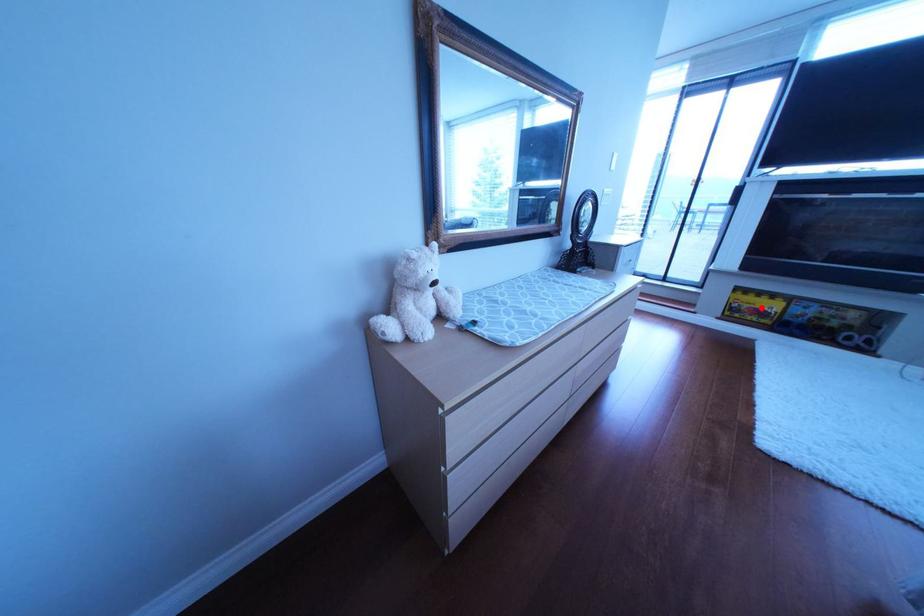
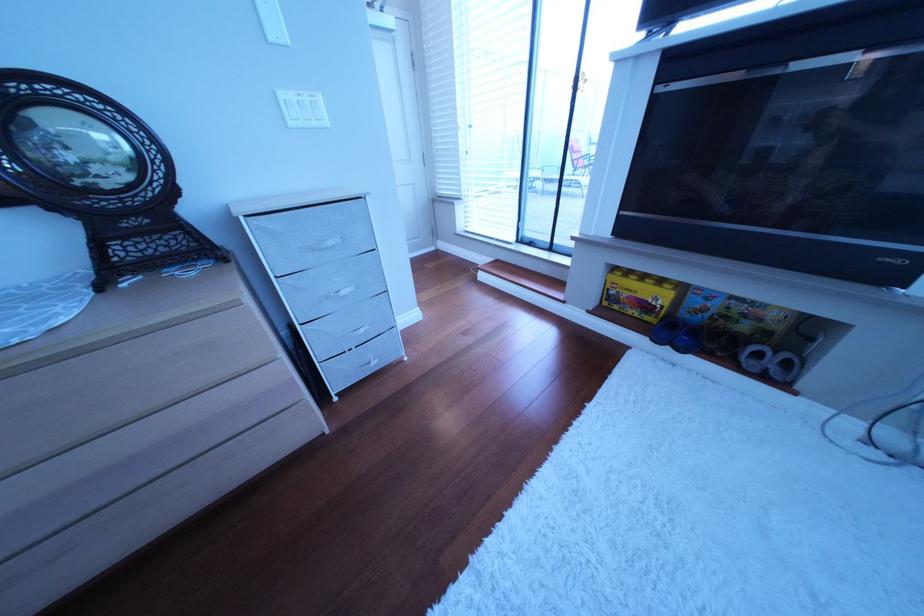
Find the pixel in the second image that matches the highlighted location in the first image.

(640, 296)